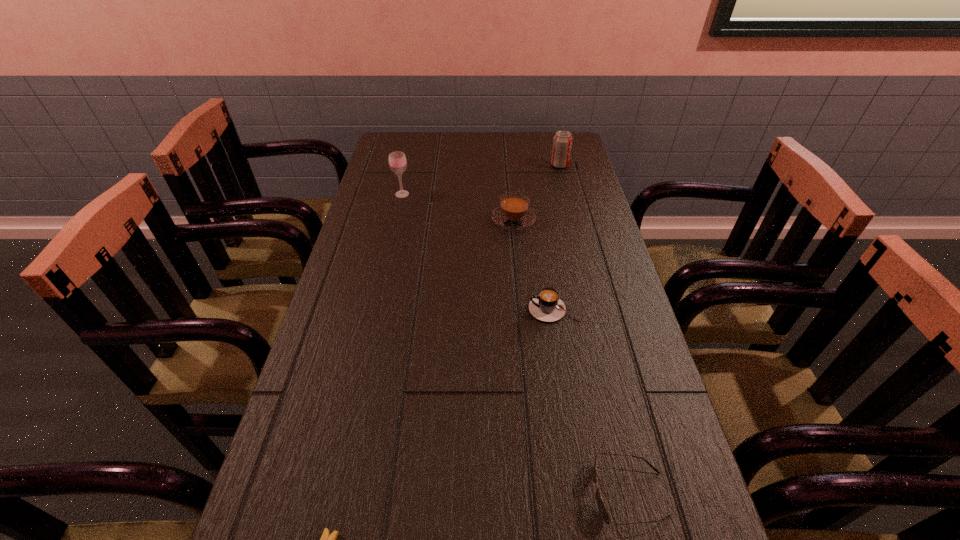
At what (x,y) coordinates should I click in order to perform the action: click on vacant area located on the left of the soda can. Please return your answer as a coordinate pair (x, y). Looking at the image, I should click on (486, 165).

Locate an element on the screen. The image size is (960, 540). vacant space located 0.210m on the back of the third farthest object is located at coordinates (509, 172).

This screenshot has width=960, height=540. Identify the location of free spot located with the handle on the side of the fourth farthest object. (435, 309).

I want to click on vacant region located with the handle on the side of the fourth farthest object, so click(x=508, y=309).

At what (x,y) coordinates should I click in order to perform the action: click on free space located 0.340m with the handle on the side of the fourth farthest object. Please return your answer as a coordinate pair (x, y). The height and width of the screenshot is (540, 960). Looking at the image, I should click on (390, 309).

Identify the location of vacant space located 0.330m on the front-facing side of the sunglasses. The image size is (960, 540). (403, 494).

At what (x,y) coordinates should I click in order to perform the action: click on vacant space located 0.270m on the front-facing side of the sunglasses. Please return your answer as a coordinate pair (x, y). Looking at the image, I should click on (438, 494).

Image resolution: width=960 pixels, height=540 pixels. Find the location of `free point located on the front-facing side of the sunglasses`. free point located on the front-facing side of the sunglasses is located at coordinates (438, 494).

Find the location of a particular element. The image size is (960, 540). object present at the far edge is located at coordinates (562, 143).

Where is `object located at the left edge`? Image resolution: width=960 pixels, height=540 pixels. object located at the left edge is located at coordinates (397, 160).